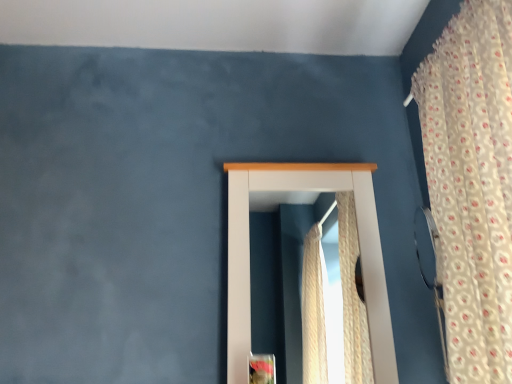
Identify the location of white wooden window at center. The width and height of the screenshot is (512, 384). [x=303, y=202].

Image resolution: width=512 pixels, height=384 pixels. What do you see at coordinates (303, 202) in the screenshot?
I see `white wooden window at center` at bounding box center [303, 202].

In order to click on floral fabric curtain at right in this screenshot , I will do `click(472, 183)`.

Describe the element at coordinates (472, 183) in the screenshot. I see `floral fabric curtain at right` at that location.

This screenshot has height=384, width=512. Identify the location of white wooden window at center. (303, 202).

Considering the positions of objects white wooden window at center and floral fabric curtain at right in the image provided, who is more to the right, white wooden window at center or floral fabric curtain at right?

floral fabric curtain at right.

Does white wooden window at center lie in front of floral fabric curtain at right?

No, it is behind floral fabric curtain at right.

Which is closer to the camera, (281, 194) or (474, 85)?

The point (474, 85) is in front.

From the image's perspective, which one is positioned higher, white wooden window at center or floral fabric curtain at right?

floral fabric curtain at right appears higher in the image.

From a real-world perspective, is white wooden window at center below floral fabric curtain at right?

Yes.

Is white wooden window at center wider than floral fabric curtain at right?

No, white wooden window at center is not wider than floral fabric curtain at right.

Does white wooden window at center have a greater height compared to floral fabric curtain at right?

No.

Considering the sizes of objects white wooden window at center and floral fabric curtain at right in the image provided, who is smaller, white wooden window at center or floral fabric curtain at right?

Smaller between the two is white wooden window at center.

Can we say white wooden window at center lies outside floral fabric curtain at right?

white wooden window at center is positioned outside floral fabric curtain at right.

Does white wooden window at center touch floral fabric curtain at right?

No.

Is white wooden window at center oriented towards floral fabric curtain at right?

Yes.

I want to click on curtain above the white wooden window at center (from the image's perspective), so click(472, 183).

Looking at this image, does floral fabric curtain at right appear on the left side of white wooden window at center?

No, floral fabric curtain at right is not to the left of white wooden window at center.

Is floral fabric curtain at right closer to the viewer compared to white wooden window at center?

Yes.

Which is behind, point (509, 19) or point (392, 376)?

The point (392, 376) is behind.

From the image's perspective, does floral fabric curtain at right appear lower than white wooden window at center?

Incorrect, from the image's perspective, floral fabric curtain at right is higher than white wooden window at center.

From a real-world perspective, is floral fabric curtain at right below white wooden window at center?

Actually, floral fabric curtain at right is physically above white wooden window at center in the real world.

Considering the sizes of objects floral fabric curtain at right and white wooden window at center in the image provided, who is wider, floral fabric curtain at right or white wooden window at center?

floral fabric curtain at right is wider.

Does floral fabric curtain at right have a greater height compared to white wooden window at center?

Yes, floral fabric curtain at right is taller than white wooden window at center.

Is floral fabric curtain at right smaller than white wooden window at center?

Incorrect, floral fabric curtain at right is not smaller in size than white wooden window at center.

Is white wooden window at center a part of floral fabric curtain at right?

Definitely not — white wooden window at center is not inside floral fabric curtain at right.

Is floral fabric curtain at right with white wooden window at center?

No.

Is floral fabric curtain at right aimed at white wooden window at center?

No, floral fabric curtain at right does not turn towards white wooden window at center.

Based on the photo, how different are the orientations of floral fabric curtain at right and white wooden window at center in degrees?

90.8 degrees.

The width and height of the screenshot is (512, 384). I want to click on window located below the floral fabric curtain at right (from the image's perspective), so coord(303,202).

What are the coordinates of `curtain above the white wooden window at center (from a real-world perspective)` in the screenshot? It's located at (472, 183).

Identify the location of window that is under the floral fabric curtain at right (from a real-world perspective). This screenshot has width=512, height=384. (303, 202).